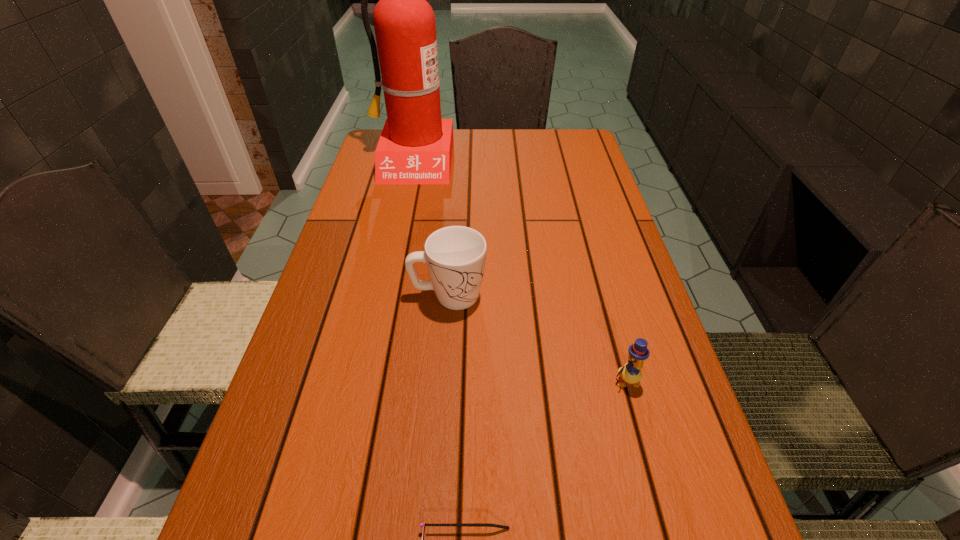
At what (x,y) coordinates should I click in order to perform the action: click on unoccupied position between the third farthest object and the second tallest object. Please return your answer as a coordinate pair (x, y). The height and width of the screenshot is (540, 960). Looking at the image, I should click on (538, 338).

Locate an element on the screen. This screenshot has width=960, height=540. free space between the duckling and the mug is located at coordinates (538, 338).

Identify the location of the second closest object to the mug. (415, 147).

What are the coordinates of `object that is the second closest to the third nearest object` in the screenshot? It's located at (415, 147).